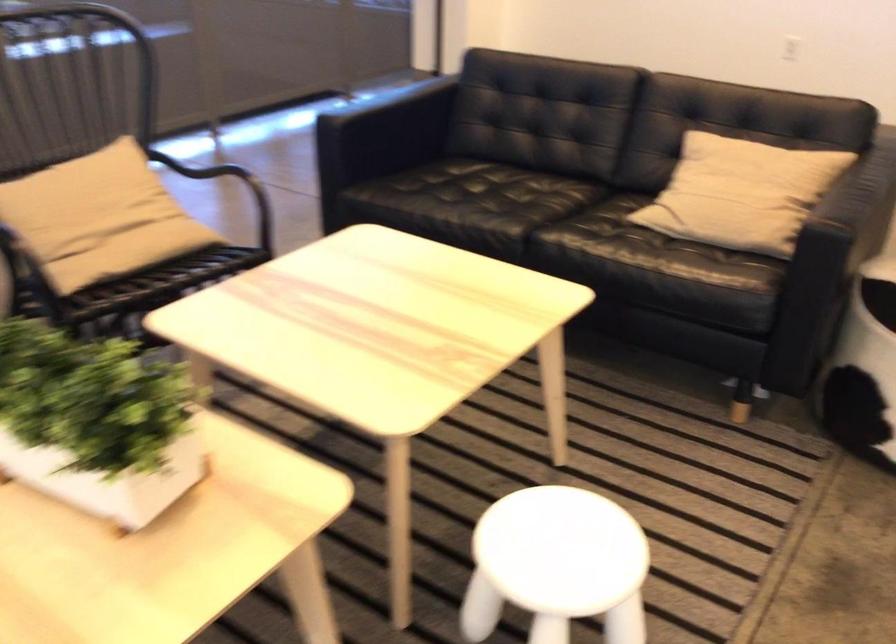
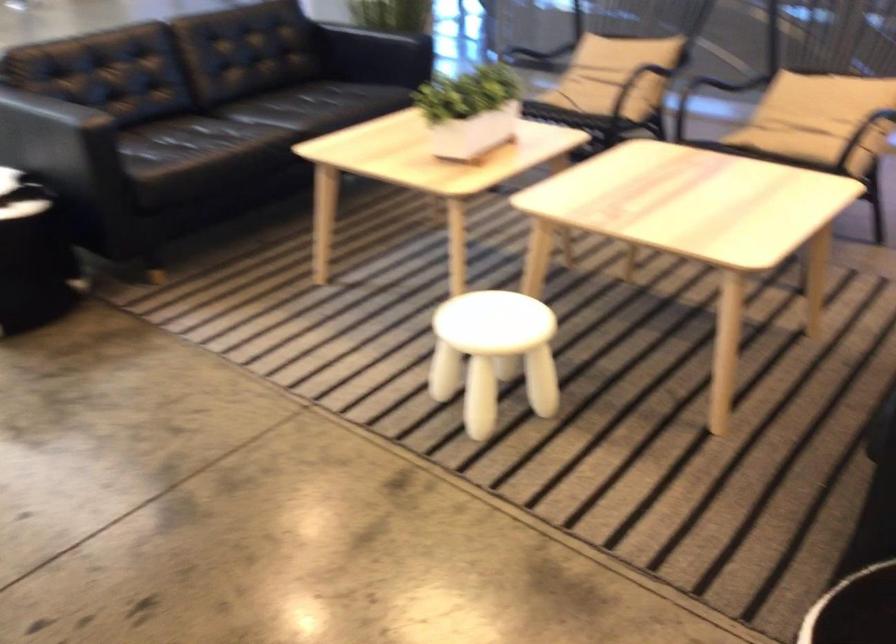
In the second image, find the point that corresponds to pixel 609 562 in the first image.

(493, 354)